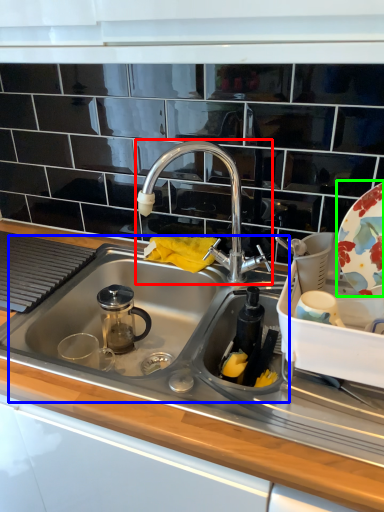
Question: Which is farther away from tap (highlighted by a red box)? sink (highlighted by a blue box) or platter (highlighted by a green box)?

Choices:
 (A) sink
 (B) platter

Answer: (B)